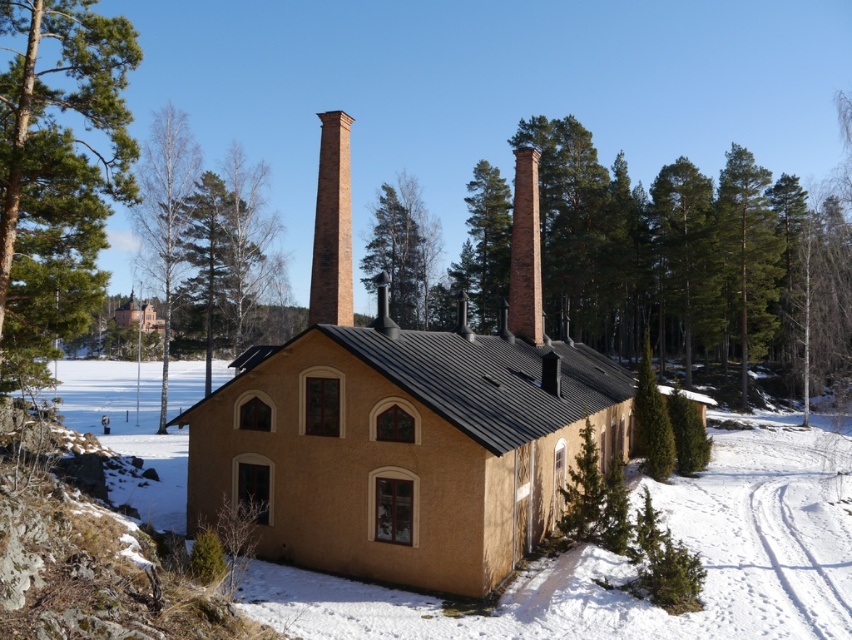
Question: Which object appears closest to the camera in this image?

Choices:
 (A) green textured pine tree at center
 (B) brown brick chimney at upper center
 (C) red brick chimney at center
 (D) bare birch tree at left

Answer: (D)

Question: Does brown brick chimney at upper center have a larger size compared to red brick chimney at center?

Choices:
 (A) yes
 (B) no

Answer: (A)

Question: Is bare birch tree at left closer to camera compared to red brick chimney at center?

Choices:
 (A) yes
 (B) no

Answer: (A)

Question: Which object is closer to the camera taking this photo?

Choices:
 (A) green leafy tree at center
 (B) bare birch tree at left
 (C) green textured tree at right

Answer: (B)

Question: Which of the following is the closest to the observer?

Choices:
 (A) green textured tree at right
 (B) white powdery snow at lower center

Answer: (B)

Question: Is green leafy tree at left to the right of brick chimney at center from the viewer's perspective?

Choices:
 (A) yes
 (B) no

Answer: (B)